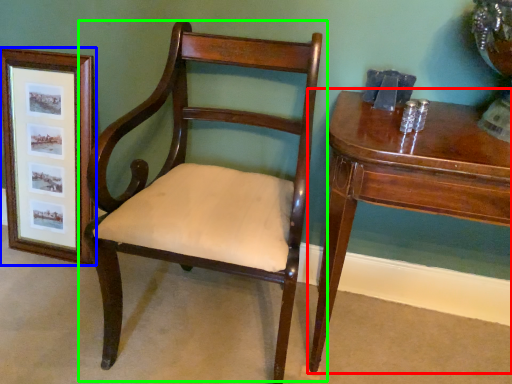
Question: Considering the real-world distances, which object is farthest from table (highlighted by a red box)? picture frame (highlighted by a blue box) or chair (highlighted by a green box)?

Choices:
 (A) picture frame
 (B) chair

Answer: (A)